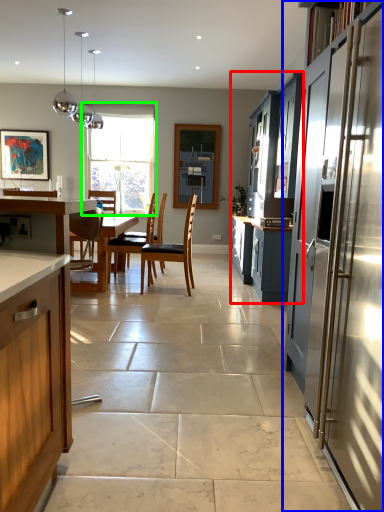
Question: Considering the real-world distances, which object is farthest from cabinetry (highlighted by a red box)? cabinetry (highlighted by a blue box) or window (highlighted by a green box)?

Choices:
 (A) cabinetry
 (B) window

Answer: (B)